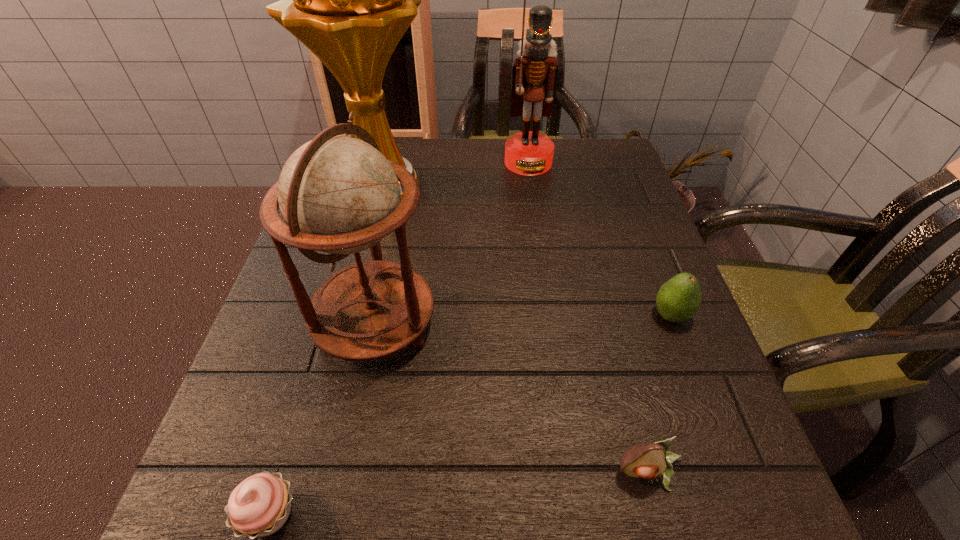
In the image, there is a desktop. At what (x,y) coordinates should I click in order to perform the action: click on vacant space at the right edge. Please return your answer as a coordinate pair (x, y). This screenshot has width=960, height=540. Looking at the image, I should click on (659, 268).

In the image, there is a desktop. At what (x,y) coordinates should I click in order to perform the action: click on vacant area at the far right corner. Please return your answer as a coordinate pair (x, y). Looking at the image, I should click on tap(616, 144).

Image resolution: width=960 pixels, height=540 pixels. I want to click on free space that is in between the globe and the left avocado, so click(513, 399).

You are a GUI agent. You are given a task and a screenshot of the screen. Output one action in this format:
    pyautogui.click(x=<x>, y=<y>)
    Task: Click on the vacant region between the left avocado and the tallest object
    The image size is (960, 540).
    Given the screenshot: What is the action you would take?
    coord(517,329)

Locate an element on the screen. vacant point located between the fourth shortest object and the right avocado is located at coordinates (523, 320).

Find the location of a particular element. empty space between the left avocado and the rightmost object is located at coordinates (660, 394).

Locate which object ranks third in proximity to the cupcake. Please provide its 2D coordinates. Your answer should be formatted as a tuple, i.e. [(x, y)], where the tuple contains the x and y coordinates of a point satisfying the conditions above.

[(349, 0)]

Select which object appears as the third closest to the right avocado. Please provide its 2D coordinates. Your answer should be formatted as a tuple, i.e. [(x, y)], where the tuple contains the x and y coordinates of a point satisfying the conditions above.

[(534, 73)]

Identify the location of free space that satisfies the following two spatial constraints: 1. on the front-facing side of the fifth shortest object; 2. at the front of the trophy_cup where the globe is prominent. (532, 186).